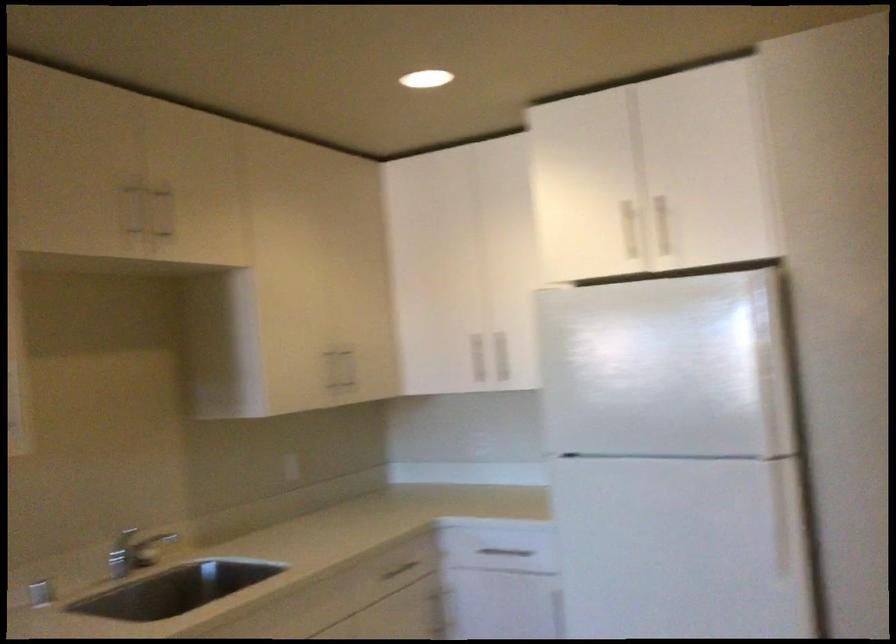
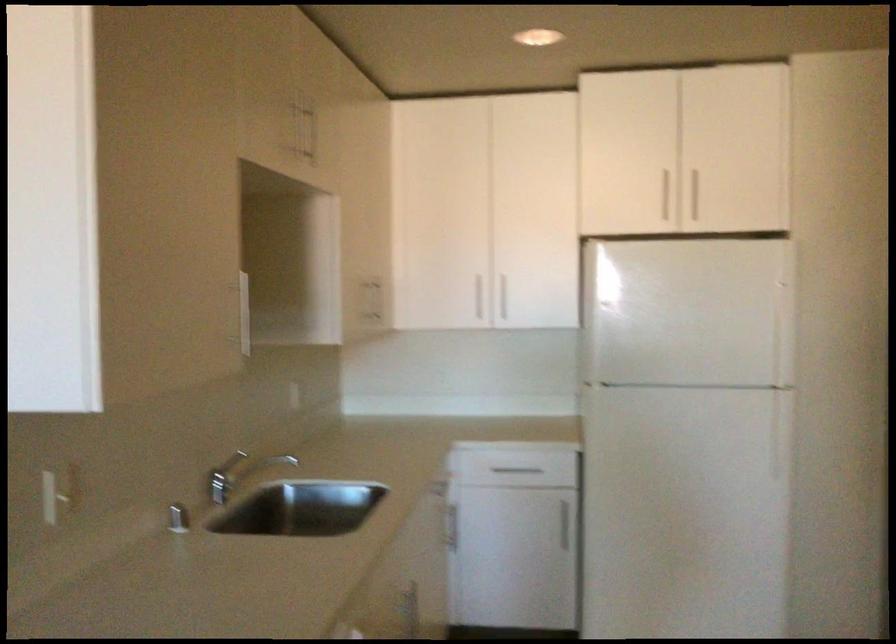
The point at (489, 550) is marked in the first image. Where is the corresponding point in the second image?

(513, 469)